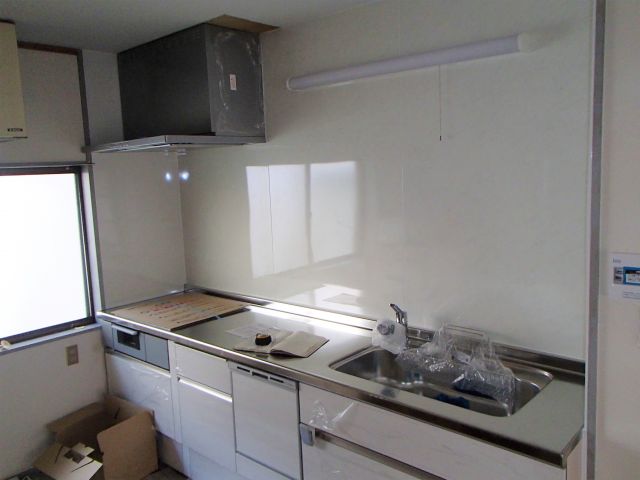
The width and height of the screenshot is (640, 480). In order to click on stove/range oven in this screenshot , I will do `click(144, 342)`.